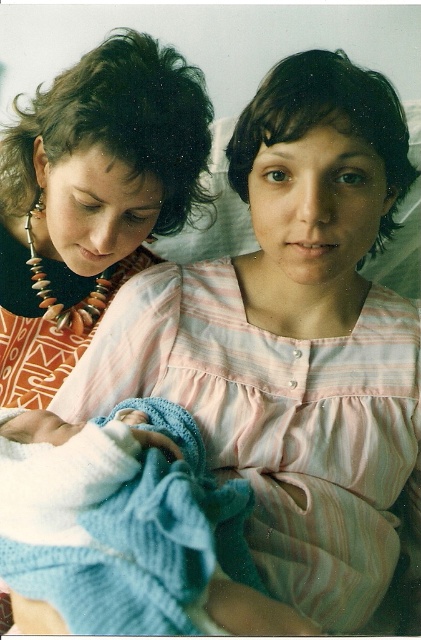
Is matte black necklace at upper left to the left of knitted blue blanket at center from the viewer's perspective?

Indeed, matte black necklace at upper left is positioned on the left side of knitted blue blanket at center.

Who is more forward, (58,308) or (172,609)?

Point (172,609) is more forward.

Does point (95, 58) come behind point (29, 419)?

Yes.

What are the coordinates of `matte black necklace at upper left` in the screenshot? It's located at (92, 198).